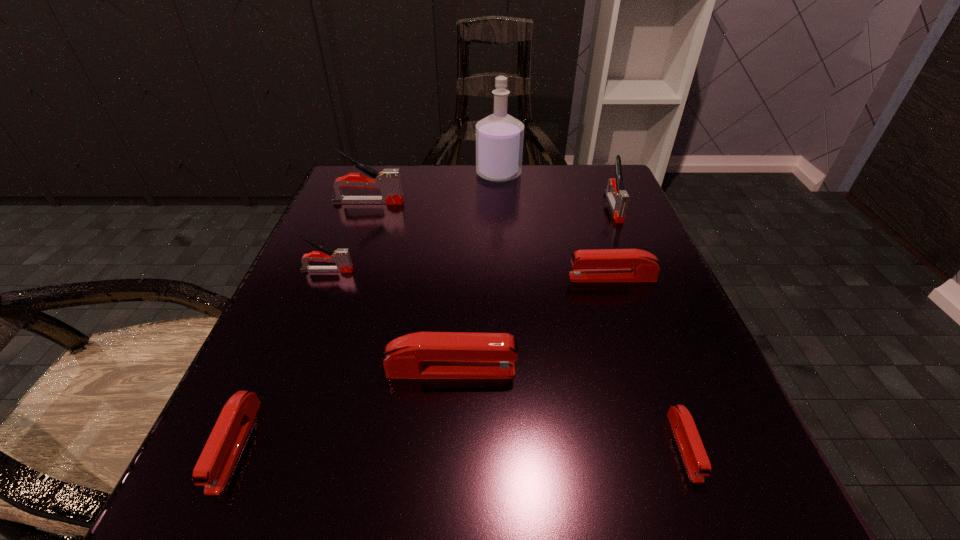
At what (x,y) coordinates should I click in order to perform the action: click on the third shortest object. Please return your answer as a coordinate pair (x, y). This screenshot has width=960, height=540. Looking at the image, I should click on (600, 265).

Identify the location of the second smallest red stapler. (215, 464).

Identify the location of the leftmost red stapler. The width and height of the screenshot is (960, 540). (215, 464).

Identify the location of the shortest object. This screenshot has height=540, width=960. (691, 447).

Where is `the shortest stapler`? the shortest stapler is located at coordinates (691, 447).

What are the coordinates of `vacant space located on the front of the perfume` in the screenshot? It's located at (506, 281).

The height and width of the screenshot is (540, 960). I want to click on free space located 0.230m on the handle side of the second tallest object, so click(x=510, y=202).

Where is `vacant space located on the handle side of the rightmost gray stapler`? vacant space located on the handle side of the rightmost gray stapler is located at coordinates click(x=640, y=271).

Image resolution: width=960 pixels, height=540 pixels. Find the location of `vacant space located 0.070m on the handle side of the smallest gray stapler`. vacant space located 0.070m on the handle side of the smallest gray stapler is located at coordinates (393, 271).

Locate an element on the screen. free space located on the front-facing side of the biggest red stapler is located at coordinates (587, 370).